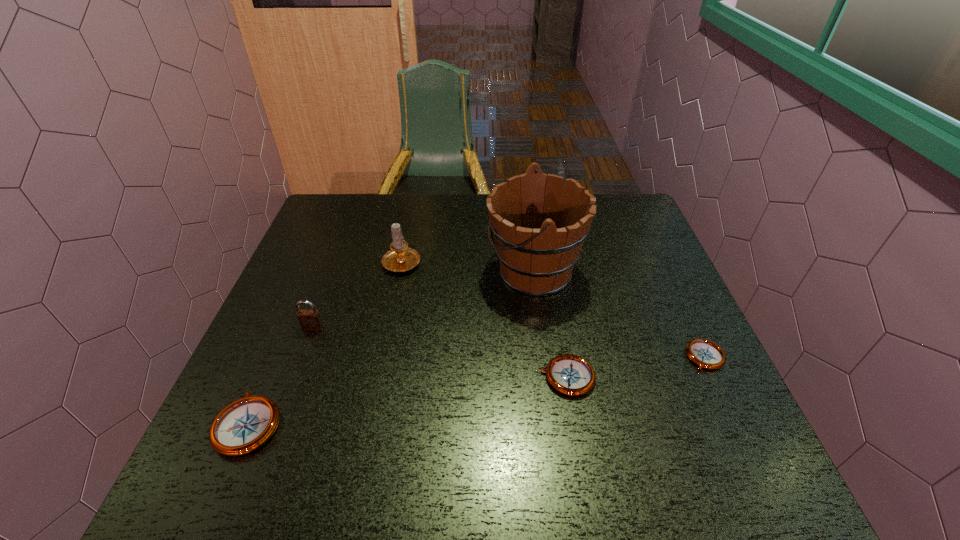
Where is `the tallest compass`? The image size is (960, 540). the tallest compass is located at coordinates click(x=243, y=426).

What are the coordinates of `the fourth tallest object` in the screenshot? It's located at (243, 426).

I want to click on the second shortest compass, so click(571, 375).

You are a GUI agent. You are given a task and a screenshot of the screen. Output one action in this format:
    pyautogui.click(x=<x>, y=<y>)
    Task: Click on the second compass from right to left
    The width and height of the screenshot is (960, 540).
    Given the screenshot: What is the action you would take?
    pyautogui.click(x=571, y=375)

Image resolution: width=960 pixels, height=540 pixels. Find the location of `the shortest compass`. the shortest compass is located at coordinates [x=706, y=354].

Identify the location of the rightmost compass. (706, 354).

The height and width of the screenshot is (540, 960). I want to click on the second tallest object, so click(x=400, y=258).

At what (x,y) coordinates should I click in order to perform the action: click on the third object from left to right. Please return your answer as a coordinate pair (x, y). Looking at the image, I should click on (400, 258).

The image size is (960, 540). I want to click on the tallest object, so click(x=539, y=227).

In order to click on the fourth shortest object in this screenshot , I will do `click(310, 320)`.